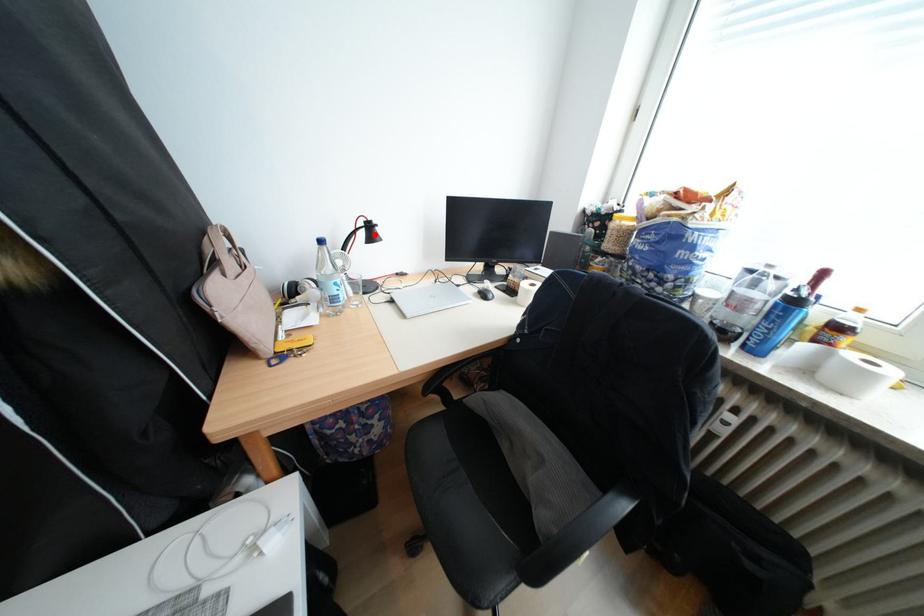
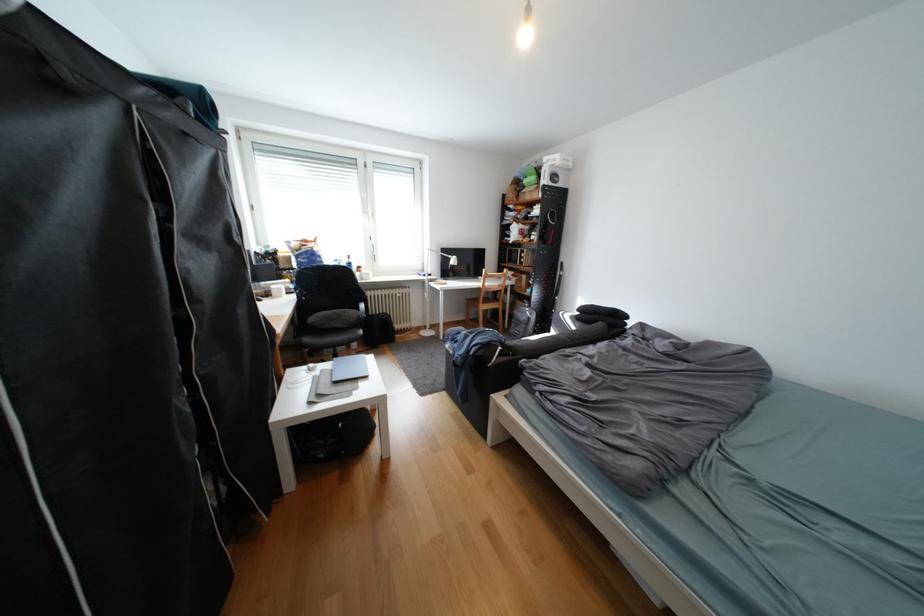
Question: I am providing you with two images of the same scene from different viewpoints. A red point is marked on the first image. At the location where the point appears in image 1, is it still visible in image 2?

Choices:
 (A) Yes
 (B) No

Answer: (B)